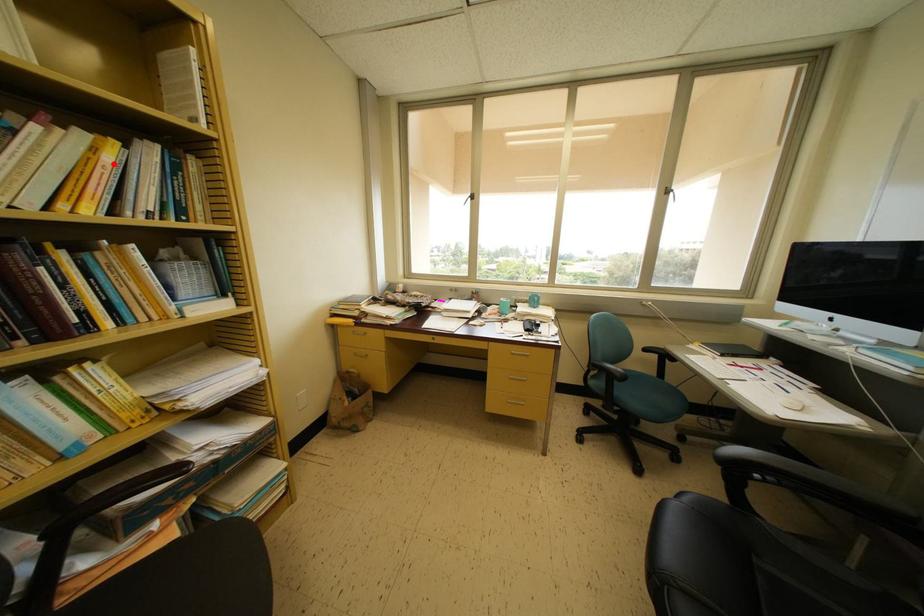
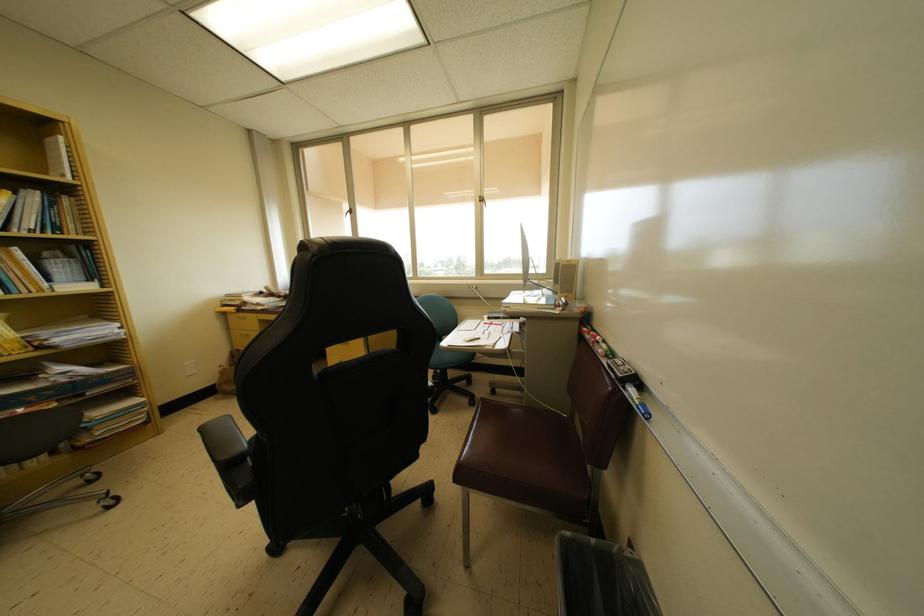
Find the pixel in the second image that matches the highlighted location in the first image.

(7, 206)